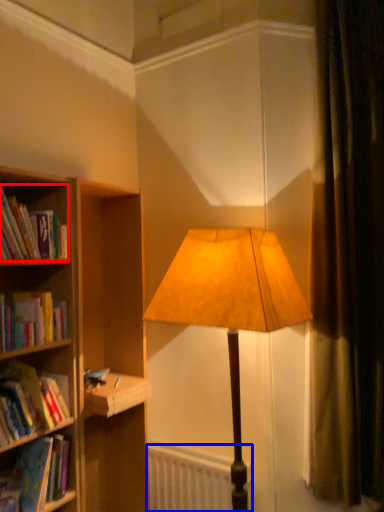
Question: Which point is further to the camera, book (highlighted by a red box) or radiator (highlighted by a blue box)?

Choices:
 (A) book
 (B) radiator

Answer: (B)